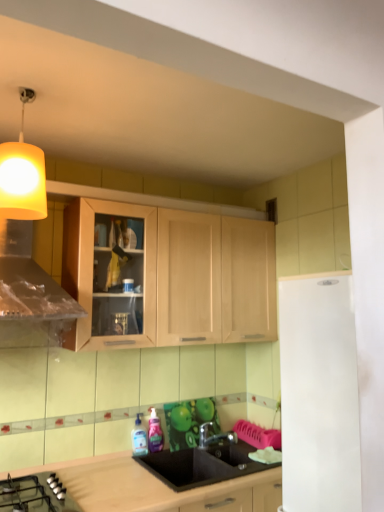
Question: Is transparent plastic bottle at sink, marked as the 2th bottle in a right-to-left arrangement, in front of white matte refrigerator at right?

Choices:
 (A) no
 (B) yes

Answer: (A)

Question: From a real-world perspective, is transparent plastic bottle at sink, which ranks as the 1th bottle in left-to-right order, positioned under white matte refrigerator at right based on gravity?

Choices:
 (A) no
 (B) yes

Answer: (B)

Question: Is transparent plastic bottle at sink, marked as the 2th bottle in a right-to-left arrangement, located outside white matte refrigerator at right?

Choices:
 (A) yes
 (B) no

Answer: (A)

Question: Would you consider transparent plastic bottle at sink, which ranks as the 1th bottle in left-to-right order, to be distant from white matte refrigerator at right?

Choices:
 (A) no
 (B) yes

Answer: (B)

Question: From a real-world perspective, is transparent plastic bottle at sink, marked as the 2th bottle in a right-to-left arrangement, positioned over white matte refrigerator at right based on gravity?

Choices:
 (A) yes
 (B) no

Answer: (B)

Question: Relative to transparent plastic bottle at sink, which ranks as the 1th bottle in left-to-right order, is pink glossy bottle at sink, marked as the first bottle in a right-to-left arrangement, in front or behind?

Choices:
 (A) behind
 (B) front

Answer: (A)

Question: In terms of height, does pink glossy bottle at sink, marked as the first bottle in a right-to-left arrangement, look taller or shorter compared to transparent plastic bottle at sink, which ranks as the 1th bottle in left-to-right order?

Choices:
 (A) short
 (B) tall

Answer: (B)

Question: In terms of width, does pink glossy bottle at sink, marked as the first bottle in a right-to-left arrangement, look wider or thinner when compared to transparent plastic bottle at sink, marked as the 2th bottle in a right-to-left arrangement?

Choices:
 (A) wide
 (B) thin

Answer: (B)

Question: Would you say pink glossy bottle at sink, marked as the first bottle in a right-to-left arrangement, is inside or outside transparent plastic bottle at sink, which ranks as the 1th bottle in left-to-right order?

Choices:
 (A) inside
 (B) outside

Answer: (B)

Question: From a real-world perspective, relative to black matte sink at center, is pink glossy bottle at sink, marked as the first bottle in a right-to-left arrangement, vertically above or below?

Choices:
 (A) above
 (B) below

Answer: (A)

Question: From the image's perspective, is pink glossy bottle at sink, the second bottle in the left-to-right sequence, located above or below black matte sink at center?

Choices:
 (A) below
 (B) above

Answer: (B)

Question: Is pink glossy bottle at sink, the second bottle in the left-to-right sequence, wider or thinner than black matte sink at center?

Choices:
 (A) thin
 (B) wide

Answer: (A)

Question: Is pink glossy bottle at sink, the second bottle in the left-to-right sequence, in front of or behind black matte sink at center in the image?

Choices:
 (A) behind
 (B) front

Answer: (A)

Question: Visually, is transparent plastic bottle at sink, which ranks as the 1th bottle in left-to-right order, positioned to the left or to the right of black glass gas stove at lower left?

Choices:
 (A) right
 (B) left

Answer: (A)

Question: From a real-world perspective, is transparent plastic bottle at sink, marked as the 2th bottle in a right-to-left arrangement, physically located above or below black glass gas stove at lower left?

Choices:
 (A) above
 (B) below

Answer: (A)